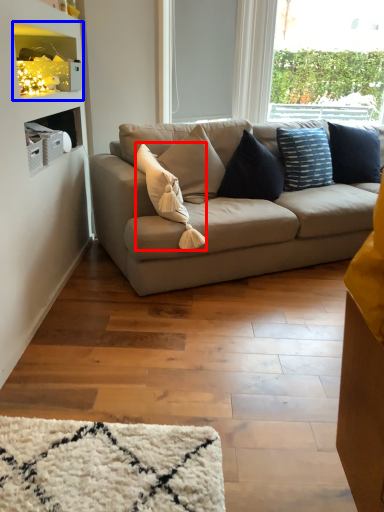
Question: Which point is further to the camera, pillow (highlighted by a red box) or shelf (highlighted by a blue box)?

Choices:
 (A) pillow
 (B) shelf

Answer: (B)